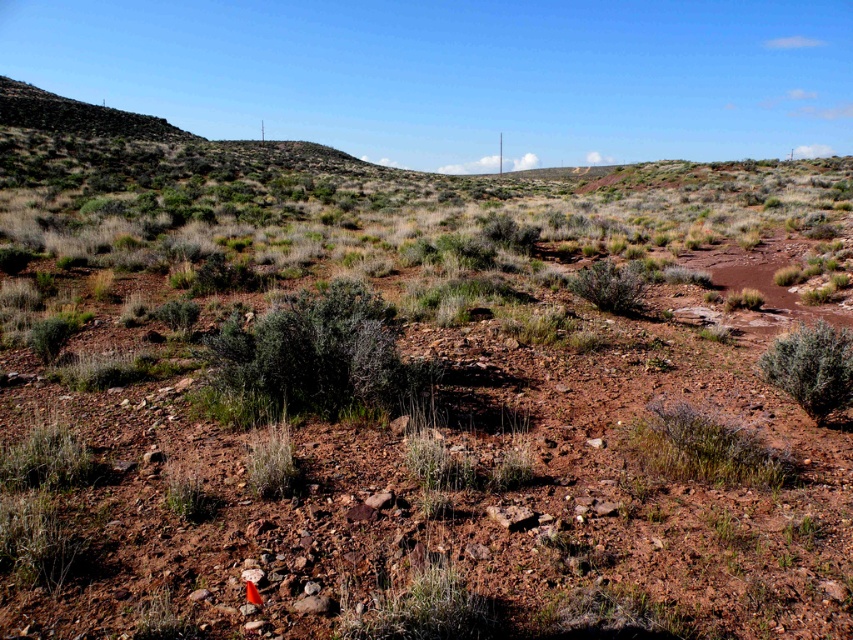
Question: Which point appears farthest from the camera in this image?

Choices:
 (A) (849, 349)
 (B) (315, 404)

Answer: (A)

Question: Which point appears closest to the camera in this image?

Choices:
 (A) (410, 372)
 (B) (802, 388)

Answer: (B)

Question: Can you confirm if green shrub at center is bigger than green fuzzy bush at right?

Choices:
 (A) yes
 (B) no

Answer: (A)

Question: Is green shrub at center below green fuzzy bush at right?

Choices:
 (A) yes
 (B) no

Answer: (B)

Question: From the image, what is the correct spatial relationship of green shrub at center in relation to green fuzzy bush at right?

Choices:
 (A) below
 (B) above

Answer: (B)

Question: Which object is farther from the camera taking this photo?

Choices:
 (A) green fuzzy bush at right
 (B) green shrub at center

Answer: (B)